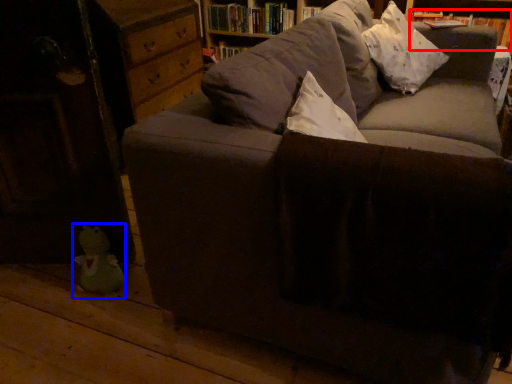
Question: Which point is further to the camera, book (highlighted by a red box) or toy (highlighted by a blue box)?

Choices:
 (A) book
 (B) toy

Answer: (A)